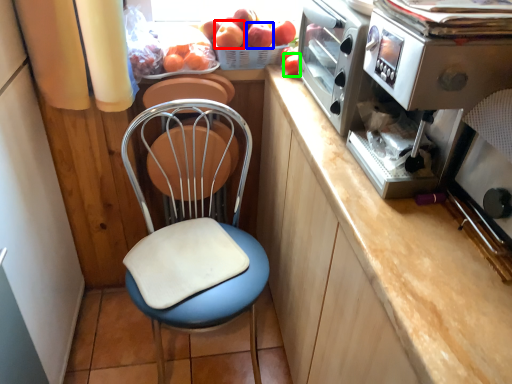
Question: Considering the real-world distances, which object is farthest from apple (highlighted by a red box)? apple (highlighted by a blue box) or fruit (highlighted by a green box)?

Choices:
 (A) apple
 (B) fruit

Answer: (B)